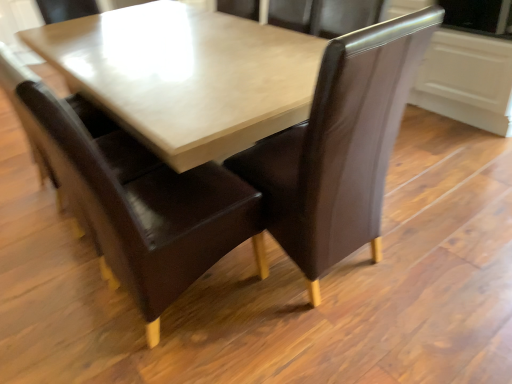
You are a GUI agent. You are given a task and a screenshot of the screen. Output one action in this format:
    pyautogui.click(x=<x>, y=<y>)
    Task: Click on the free point in front of brown leather chair at center, the first chair in the left-to-right sequence
    The width and height of the screenshot is (512, 384).
    Given the screenshot: What is the action you would take?
    pyautogui.click(x=194, y=359)